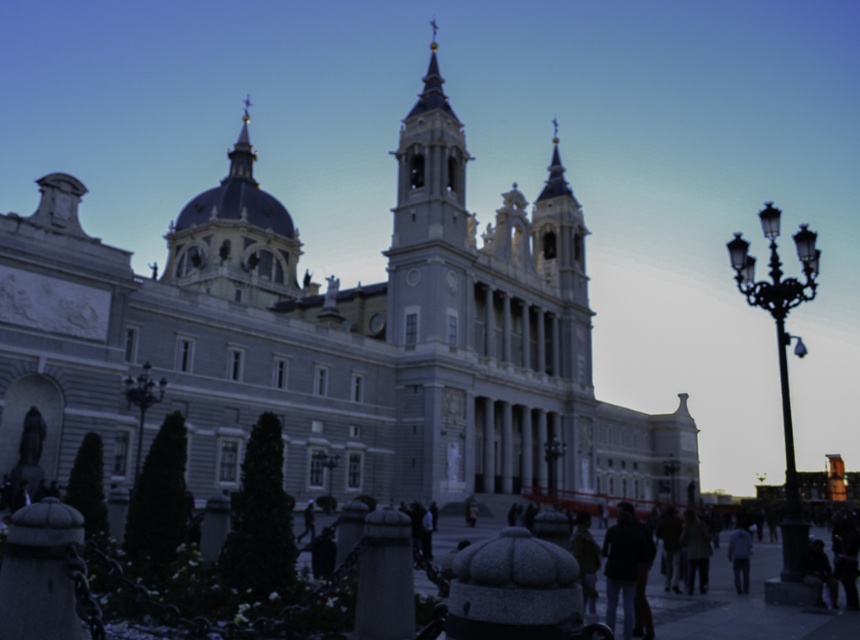
Question: Which object is farther from the camera taking this photo?

Choices:
 (A) smooth stone tower at center
 (B) gold domed dome at upper center

Answer: (B)

Question: Among these objects, which one is farthest from the camera?

Choices:
 (A) gray stone church at center
 (B) light blue fabric jacket at lower right

Answer: (B)

Question: Which of the following is the closest to the observer?

Choices:
 (A) (315, 304)
 (B) (462, 173)
 (C) (249, 304)
 (D) (744, 560)

Answer: (D)

Question: Does gold domed dome at upper center appear on the left side of light blue fabric jacket at lower right?

Choices:
 (A) yes
 (B) no

Answer: (A)

Question: From the image, what is the correct spatial relationship of smooth stone tower at center in relation to light blue fabric jacket at lower right?

Choices:
 (A) left
 (B) right

Answer: (A)

Question: Is the position of gray stone church at center less distant than that of gold domed dome at upper center?

Choices:
 (A) yes
 (B) no

Answer: (A)